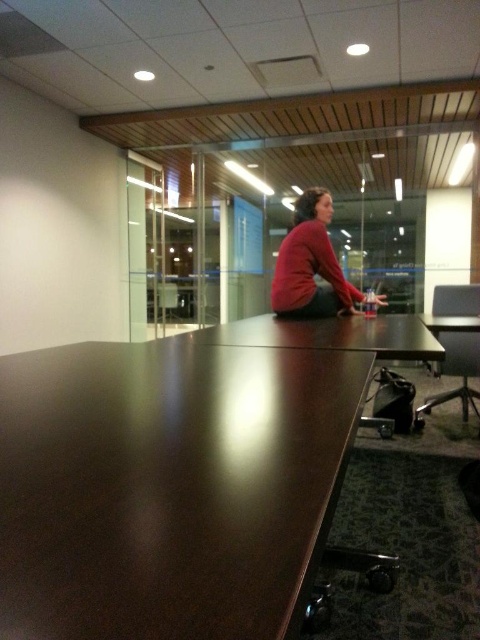
You are moving a 6 feet long object from the glossy wood table at center to the matte brown table at lower right. Can you move it without tilting it?

The distance between the glossy wood table at center and the matte brown table at lower right is 6.23 feet. Since the object is 6 feet long, it can be moved without tilting as there is enough space between them.

You are organizing a small event and need to place a 30 inch wide decorative item on the table. Based on the distance between the matte red sweater at center and the matte brown table at lower right, will the item fit on the table?

The distance between the matte red sweater at center and the matte brown table at lower right is 29.00 inches. Since the decorative item is 30 inches wide, it will not fit as it is 1 inch wider than the available space.